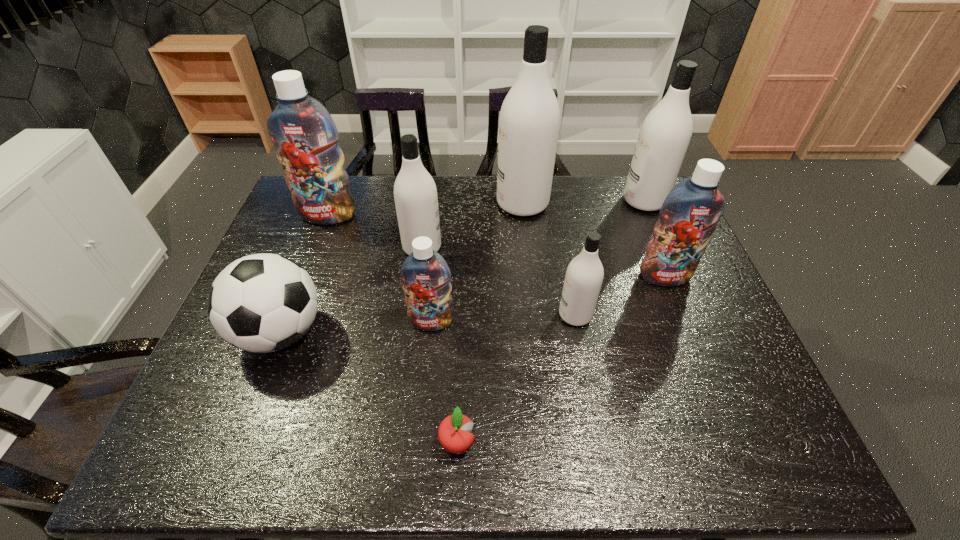
Where is `free point between the nearest object and the second blue shampoo from left to right`? free point between the nearest object and the second blue shampoo from left to right is located at coordinates (444, 383).

This screenshot has width=960, height=540. I want to click on vacant area between the shortest object and the second blue shampoo from left to right, so click(444, 383).

You are a GUI agent. You are given a task and a screenshot of the screen. Output one action in this format:
    pyautogui.click(x=<x>, y=<y>)
    Task: Click on the free space between the second biggest blue shampoo and the black soccer ball
    The height and width of the screenshot is (540, 960).
    Given the screenshot: What is the action you would take?
    pyautogui.click(x=472, y=305)

Where is `unoccupied position between the rightmost white shampoo and the eighth tallest object`? The height and width of the screenshot is (540, 960). unoccupied position between the rightmost white shampoo and the eighth tallest object is located at coordinates (463, 267).

Identify the location of free point between the apple and the nearest white shampoo. (516, 379).

Find the location of `vacant space that is in between the fifth nearest object and the black soccer ball`. vacant space that is in between the fifth nearest object and the black soccer ball is located at coordinates (472, 305).

The height and width of the screenshot is (540, 960). Identify the location of blank region between the second blue shampoo from right to left and the tallest shampoo. (477, 262).

The width and height of the screenshot is (960, 540). In order to click on object that stands as the third closest to the farthest blue shampoo in this screenshot , I will do `click(426, 276)`.

What are the coordinates of `the closest object to the tallest shampoo` in the screenshot? It's located at (415, 193).

Image resolution: width=960 pixels, height=540 pixels. In order to click on shampoo that is the second closest to the biggest blue shampoo in this screenshot , I will do `click(426, 276)`.